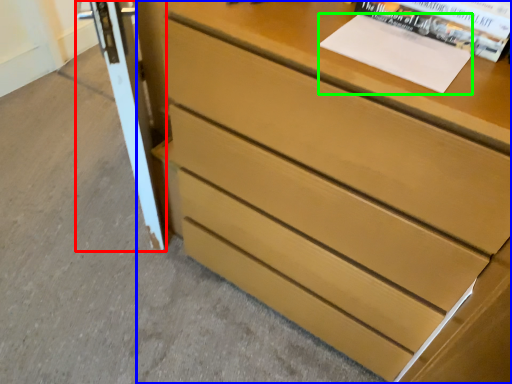
Question: Which is nearer to the screen door (highlighted by a red box)? chest of drawers (highlighted by a blue box) or paperback book (highlighted by a green box).

Choices:
 (A) chest of drawers
 (B) paperback book

Answer: (A)